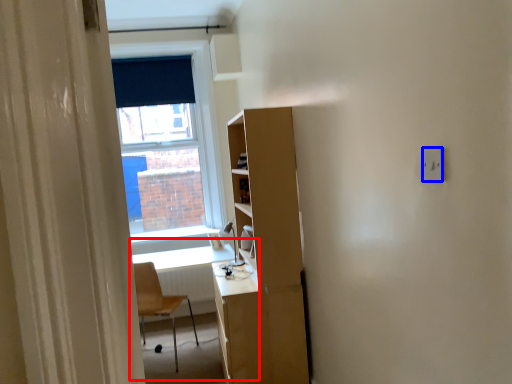
Question: Which object appears closest to the camera in this image, computer desk (highlighted by a red box) or electric outlet (highlighted by a blue box)?

Choices:
 (A) computer desk
 (B) electric outlet

Answer: (B)